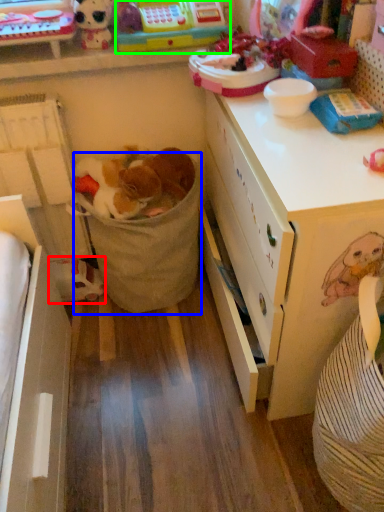
Question: Estimate the real-world distances between objects in this image. Which object is closer to toy (highlighted by a red box), laundry basket (highlighted by a blue box) or toy (highlighted by a green box)?

Choices:
 (A) laundry basket
 (B) toy

Answer: (A)